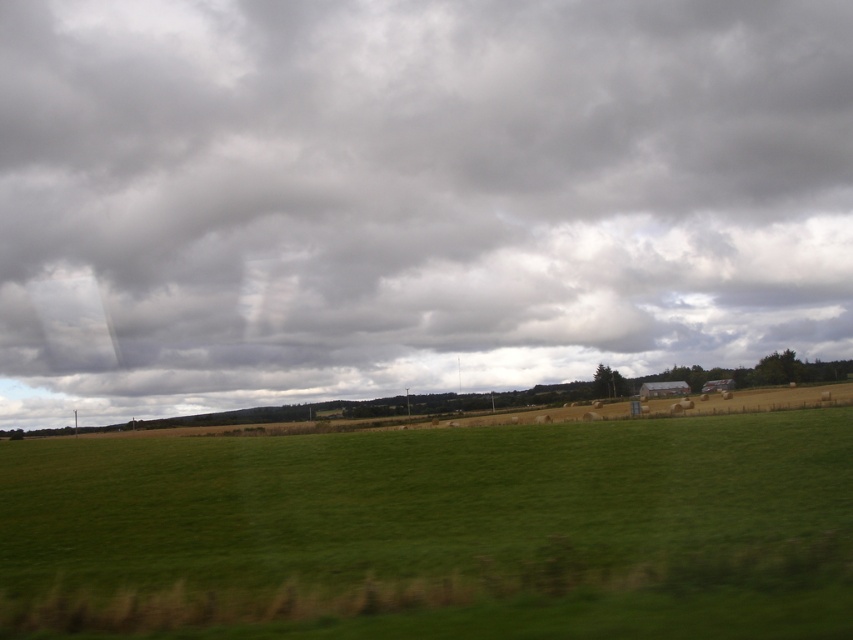
Does point (511, 36) come in front of point (172, 502)?

No, (511, 36) is behind (172, 502).

Between point (161, 179) and point (370, 438), which one is positioned behind?

Positioned behind is point (161, 179).

I want to click on gray cloudy sky at upper center, so click(416, 192).